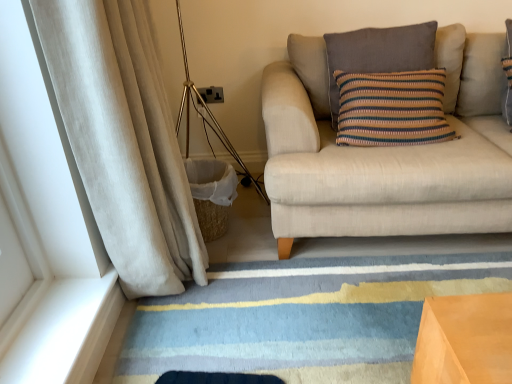
Question: Can you confirm if knitted cotton pillow at upper right is positioned to the right of striped wool rug at lower center?

Choices:
 (A) yes
 (B) no

Answer: (A)

Question: Is knitted cotton pillow at upper right closer to camera compared to striped wool rug at lower center?

Choices:
 (A) no
 (B) yes

Answer: (A)

Question: Could you tell me if knitted cotton pillow at upper right is facing striped wool rug at lower center?

Choices:
 (A) yes
 (B) no

Answer: (B)

Question: Is knitted cotton pillow at upper right further to camera compared to striped wool rug at lower center?

Choices:
 (A) no
 (B) yes

Answer: (B)

Question: Is knitted cotton pillow at upper right not inside striped wool rug at lower center?

Choices:
 (A) yes
 (B) no

Answer: (A)

Question: From a real-world perspective, is knitted cotton pillow at upper right physically below striped wool rug at lower center?

Choices:
 (A) yes
 (B) no

Answer: (B)

Question: Would you say beige fabric couch at right is a long distance from gold metallic tripod lamp at left?

Choices:
 (A) no
 (B) yes

Answer: (A)

Question: Is beige fabric couch at right to the right of gold metallic tripod lamp at left from the viewer's perspective?

Choices:
 (A) no
 (B) yes

Answer: (B)

Question: Does beige fabric couch at right have a greater width compared to gold metallic tripod lamp at left?

Choices:
 (A) yes
 (B) no

Answer: (A)

Question: Does beige fabric couch at right have a larger size compared to gold metallic tripod lamp at left?

Choices:
 (A) yes
 (B) no

Answer: (A)

Question: Can you confirm if beige fabric couch at right is smaller than gold metallic tripod lamp at left?

Choices:
 (A) no
 (B) yes

Answer: (A)

Question: Considering the relative sizes of beige fabric couch at right and gold metallic tripod lamp at left in the image provided, is beige fabric couch at right shorter than gold metallic tripod lamp at left?

Choices:
 (A) yes
 (B) no

Answer: (A)

Question: Is knitted cotton pillow at upper right wider than beige corduroy curtain at left?

Choices:
 (A) yes
 (B) no

Answer: (B)